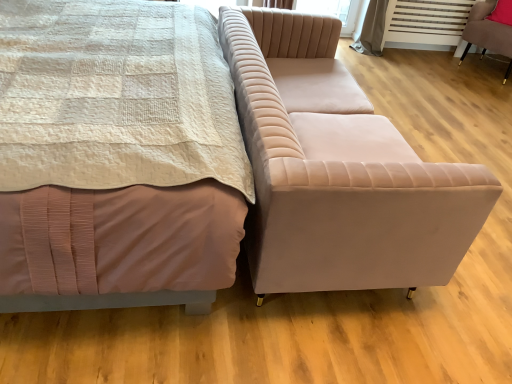
Question: Is matte pink bed at center positioned behind velvet beige couch at center?

Choices:
 (A) no
 (B) yes

Answer: (A)

Question: Does matte pink bed at center have a larger size compared to velvet beige couch at center?

Choices:
 (A) yes
 (B) no

Answer: (A)

Question: Does matte pink bed at center touch velvet beige couch at center?

Choices:
 (A) yes
 (B) no

Answer: (B)

Question: Is matte pink bed at center to the right of velvet beige couch at center from the viewer's perspective?

Choices:
 (A) no
 (B) yes

Answer: (A)

Question: Considering the relative sizes of matte pink bed at center and velvet beige couch at center in the image provided, is matte pink bed at center shorter than velvet beige couch at center?

Choices:
 (A) no
 (B) yes

Answer: (A)

Question: From the image's perspective, is matte pink bed at center above or below velvet pink chair at right?

Choices:
 (A) above
 (B) below

Answer: (B)

Question: Based on their sizes in the image, would you say matte pink bed at center is bigger or smaller than velvet pink chair at right?

Choices:
 (A) big
 (B) small

Answer: (A)

Question: From their relative heights in the image, would you say matte pink bed at center is taller or shorter than velvet pink chair at right?

Choices:
 (A) short
 (B) tall

Answer: (B)

Question: Based on their positions, is matte pink bed at center located to the left or right of velvet pink chair at right?

Choices:
 (A) left
 (B) right

Answer: (A)

Question: Considering the positions of point (159, 254) and point (437, 185), is point (159, 254) closer or farther from the camera than point (437, 185)?

Choices:
 (A) farther
 (B) closer

Answer: (B)

Question: Based on their positions, is matte pink bed at center located to the left or right of velvet beige couch at center?

Choices:
 (A) right
 (B) left

Answer: (B)

Question: From a real-world perspective, relative to velvet beige couch at center, is matte pink bed at center vertically above or below?

Choices:
 (A) below
 (B) above

Answer: (B)

Question: Is matte pink bed at center bigger or smaller than velvet beige couch at center?

Choices:
 (A) small
 (B) big

Answer: (B)

Question: Considering the positions of velvet beige couch at center and matte pink bed at center in the image, is velvet beige couch at center wider or thinner than matte pink bed at center?

Choices:
 (A) wide
 (B) thin

Answer: (B)

Question: In the image, is velvet beige couch at center positioned in front of or behind matte pink bed at center?

Choices:
 (A) front
 (B) behind

Answer: (B)